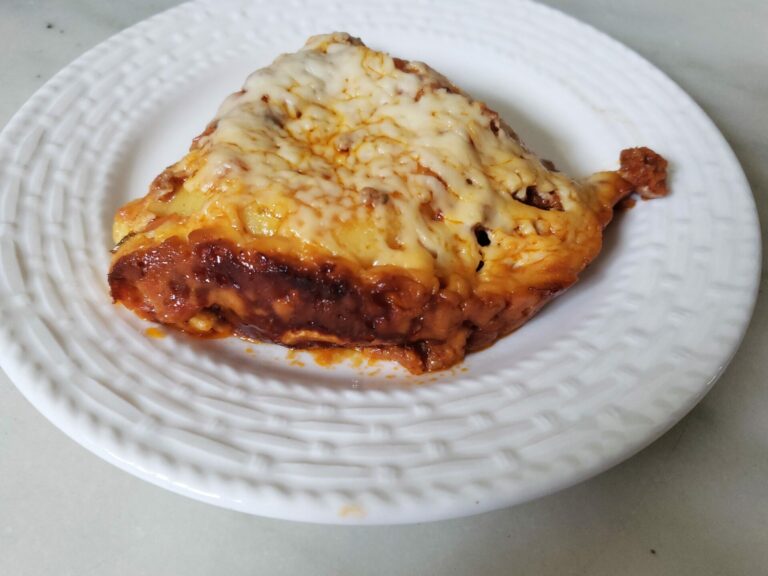
Where is `stain on botton of plate`? This screenshot has height=576, width=768. stain on botton of plate is located at coordinates (320, 358).